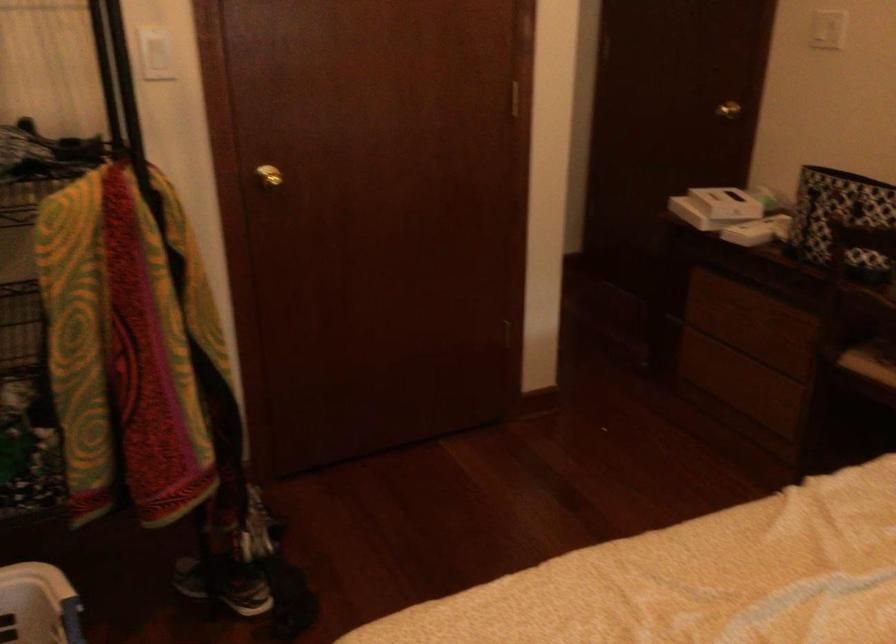
Where would you lift the patterned tote bag? Please return your answer as a coordinate pair (x, y).

(840, 218)